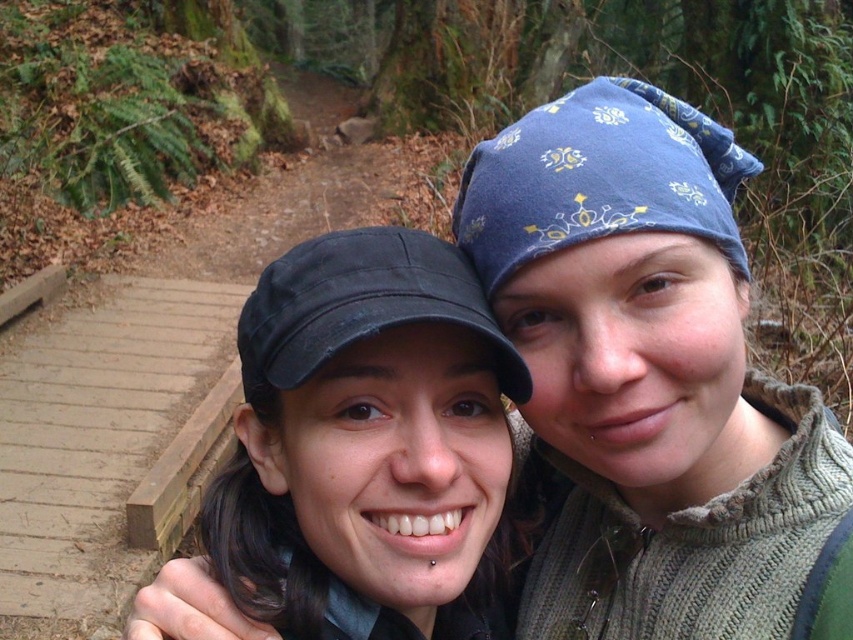
Question: Does blue printed bandana at upper right appear under matte black cap at center?

Choices:
 (A) yes
 (B) no

Answer: (B)

Question: Based on their relative distances, which object is farther from the blue printed bandana at upper right?

Choices:
 (A) matte black cap at center
 (B) black fabric cap at center
 (C) blue printed fabric bandana at upper right

Answer: (B)

Question: Is blue printed bandana at upper right behind blue printed fabric bandana at upper right?

Choices:
 (A) no
 (B) yes

Answer: (A)

Question: Which object is closer to the camera taking this photo?

Choices:
 (A) black fabric cap at center
 (B) matte black cap at center

Answer: (B)

Question: Is matte black cap at center above black fabric cap at center?

Choices:
 (A) yes
 (B) no

Answer: (B)

Question: Considering the real-world distances, which object is farthest from the blue printed fabric bandana at upper right?

Choices:
 (A) matte black cap at center
 (B) black fabric cap at center

Answer: (A)